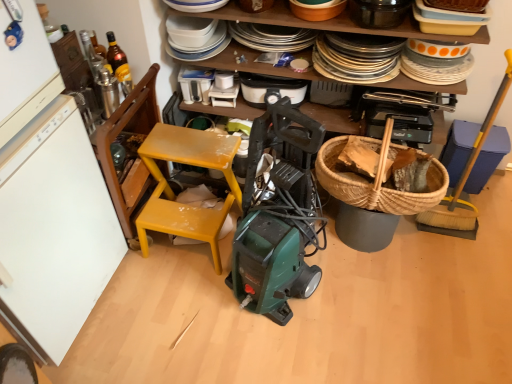
Locate an element on the screen. stainless steel pot at upper center, which is the third appliance in right-to-left order is located at coordinates (379, 13).

What do you see at coordinates (326, 22) in the screenshot?
I see `wooden plate rack at upper center, placed as the second shelf when sorted from front to back` at bounding box center [326, 22].

The height and width of the screenshot is (384, 512). What do you see at coordinates (108, 91) in the screenshot?
I see `metallic silver thermos at upper left, the first appliance positioned from the left` at bounding box center [108, 91].

What do you see at coordinates (195, 84) in the screenshot? The height and width of the screenshot is (384, 512). I see `white plastic container at upper center, the 6th appliance viewed from the right` at bounding box center [195, 84].

In order to face black plastic vacuum cleaner at center, arranged as the 4th appliance when viewed from the right, should I rotate leftwards or rightwards?

A 1.938 degree turn to the right will do.

You are a GUI agent. You are given a task and a screenshot of the screen. Output one action in this format:
    pyautogui.click(x=<x>, y=<y>)
    Task: Click on the yellow plastic broom at right, which is counted as the 2th appliance, starting from the right
    The image size is (512, 384).
    Given the screenshot: What is the action you would take?
    pyautogui.click(x=465, y=179)

I want to click on white matte refrigerator at left, so click(48, 200).

Between stainless steel pot at upper center, which is the third appliance in right-to-left order, and yellow plastic broom at right, which is counted as the 2th appliance, starting from the right, which one has smaller width?

yellow plastic broom at right, which is counted as the 2th appliance, starting from the right, is thinner.

Considering the positions of point (392, 15) and point (474, 222), is point (392, 15) closer or farther from the camera than point (474, 222)?

Clearly, point (392, 15) is closer to the camera than point (474, 222).

From the picture: Measure the distance between stainless steel pot at upper center, the 5th appliance viewed from the left, and yellow plastic broom at right, which is counted as the 2th appliance, starting from the right.

They are 75.41 centimeters apart.

Is stainless steel pot at upper center, which is the third appliance in right-to-left order, aimed at yellow plastic broom at right, which is counted as the 2th appliance, starting from the right?

No.

Identify the location of appliance that is the 4th one below the wooden shelves at upper center, the 2th shelf from the back (from a real-world perspective). The height and width of the screenshot is (384, 512). (270, 90).

Between wooden shelves at upper center, the 2th shelf from the back, and black plastic vacuum cleaner at center, placed as the fourth appliance when sorted from left to right, which one appears on the right side from the viewer's perspective?

Positioned to the right is wooden shelves at upper center, the 2th shelf from the back.

Does wooden shelves at upper center, the 2th shelf from the back, have a greater height compared to black plastic vacuum cleaner at center, arranged as the 4th appliance when viewed from the right?

In fact, wooden shelves at upper center, the 2th shelf from the back, may be shorter than black plastic vacuum cleaner at center, arranged as the 4th appliance when viewed from the right.

Which is correct: yellow matte chair at center is inside translucent glass bottle at upper left, or outside of it?

yellow matte chair at center exists outside the volume of translucent glass bottle at upper left.

From the image's perspective, would you say yellow matte chair at center is positioned over translucent glass bottle at upper left?

Actually, yellow matte chair at center appears below translucent glass bottle at upper left in the image.

Who is shorter, yellow matte chair at center or translucent glass bottle at upper left?

translucent glass bottle at upper left.

Which object is positioned more to the right, black plastic vacuum cleaner at center, placed as the fourth appliance when sorted from left to right, or white plastic toaster at upper center, the fifth appliance from the right?

black plastic vacuum cleaner at center, placed as the fourth appliance when sorted from left to right, is more to the right.

Which is closer, (280, 88) or (214, 83)?

The point (280, 88) is in front.

From a real-world perspective, is black plastic vacuum cleaner at center, placed as the fourth appliance when sorted from left to right, positioned above or below white plastic toaster at upper center, the third appliance when ordered from left to right?

From a real-world perspective, black plastic vacuum cleaner at center, placed as the fourth appliance when sorted from left to right, is physically above white plastic toaster at upper center, the third appliance when ordered from left to right.

Is black plastic vacuum cleaner at center, placed as the fourth appliance when sorted from left to right, not close to white plastic toaster at upper center, the third appliance when ordered from left to right?

No, there isn't a large distance between black plastic vacuum cleaner at center, placed as the fourth appliance when sorted from left to right, and white plastic toaster at upper center, the third appliance when ordered from left to right.

Who is bigger, metallic silver thermos at upper left, the seventh appliance in the right-to-left sequence, or yellow plastic broom at right, which is counted as the 2th appliance, starting from the right?

yellow plastic broom at right, which is counted as the 2th appliance, starting from the right, is bigger.

The height and width of the screenshot is (384, 512). Find the location of `appliance that is the 5th one when counting leftward from the yellow plastic broom at right, which is the sixth appliance from left to right`. appliance that is the 5th one when counting leftward from the yellow plastic broom at right, which is the sixth appliance from left to right is located at coordinates (108, 91).

Considering the relative positions of metallic silver thermos at upper left, the seventh appliance in the right-to-left sequence, and yellow plastic broom at right, which is counted as the 2th appliance, starting from the right, in the image provided, is metallic silver thermos at upper left, the seventh appliance in the right-to-left sequence, to the right of yellow plastic broom at right, which is counted as the 2th appliance, starting from the right, from the viewer's perspective?

No, metallic silver thermos at upper left, the seventh appliance in the right-to-left sequence, is not to the right of yellow plastic broom at right, which is counted as the 2th appliance, starting from the right.

From the image's perspective, is metallic silver thermos at upper left, the seventh appliance in the right-to-left sequence, located beneath yellow plastic broom at right, which is counted as the 2th appliance, starting from the right?

Actually, metallic silver thermos at upper left, the seventh appliance in the right-to-left sequence, appears above yellow plastic broom at right, which is counted as the 2th appliance, starting from the right, in the image.

Does point (226, 89) appear closer or farther from the camera than point (188, 69)?

Point (226, 89) appears to be closer to the viewer than point (188, 69).

Is white plastic toaster at upper center, the fifth appliance from the right, oriented away from white plastic container at upper center, which appears as the second appliance when viewed from the left?

No, white plastic container at upper center, which appears as the second appliance when viewed from the left, is not at the back of white plastic toaster at upper center, the fifth appliance from the right.

Considering the relative positions of white plastic toaster at upper center, the third appliance when ordered from left to right, and white plastic container at upper center, the 6th appliance viewed from the right, in the image provided, is white plastic toaster at upper center, the third appliance when ordered from left to right, in front of white plastic container at upper center, the 6th appliance viewed from the right,?

Yes, white plastic toaster at upper center, the third appliance when ordered from left to right, is closer to the camera.

Find the location of `appliance that is the 1st one when counting backward from the white plastic toaster at upper center, the third appliance when ordered from left to right`. appliance that is the 1st one when counting backward from the white plastic toaster at upper center, the third appliance when ordered from left to right is located at coordinates (195, 84).

Considering the relative sizes of white plastic container at upper center, the 6th appliance viewed from the right, and black plastic vacuum cleaner at center, arranged as the 4th appliance when viewed from the right, in the image provided, is white plastic container at upper center, the 6th appliance viewed from the right, shorter than black plastic vacuum cleaner at center, arranged as the 4th appliance when viewed from the right,?

Yes, white plastic container at upper center, the 6th appliance viewed from the right, is shorter than black plastic vacuum cleaner at center, arranged as the 4th appliance when viewed from the right.

Which appliance is the 2nd one when counting from the front of the white plastic container at upper center, the 6th appliance viewed from the right? Please provide its 2D coordinates.

[(270, 90)]

Is point (182, 88) closer or farther from the camera than point (243, 93)?

Point (182, 88) appears to be farther away from the viewer than point (243, 93).

From the image's perspective, does white plastic container at upper center, which appears as the second appliance when viewed from the left, appear lower than black plastic vacuum cleaner at center, arranged as the 4th appliance when viewed from the right?

No, from the image's perspective, white plastic container at upper center, which appears as the second appliance when viewed from the left, is not beneath black plastic vacuum cleaner at center, arranged as the 4th appliance when viewed from the right.

Find the location of `the 2nd appliance in front of the yellow plastic broom at right, which is counted as the 2th appliance, starting from the right, counting from the anchor's position`. the 2nd appliance in front of the yellow plastic broom at right, which is counted as the 2th appliance, starting from the right, counting from the anchor's position is located at coordinates (379, 13).

This screenshot has width=512, height=384. I want to click on the 1st appliance to the left of the wooden shelves at upper center, which is the 1th shelf in front-to-back order, starting your count from the anchor, so click(270, 90).

Which object lies nearer to the anchor point stainless steel pot at upper center, the 5th appliance viewed from the left, metallic silver thermos at upper left, the seventh appliance in the right-to-left sequence, or wooden plate rack at upper center, the first shelf viewed from the back?

wooden plate rack at upper center, the first shelf viewed from the back.

Considering their positions, is stainless steel pot at upper center, which is the third appliance in right-to-left order, positioned closer to wooden plate rack at upper center, placed as the second shelf when sorted from front to back, than woven brown picnic basket at right?

The object closer to wooden plate rack at upper center, placed as the second shelf when sorted from front to back, is stainless steel pot at upper center, which is the third appliance in right-to-left order.

From the image, which object appears to be nearer to stainless steel pot at upper center, the 5th appliance viewed from the left, wooden shelves at upper center, which is the 1th shelf in front-to-back order, or blue plastic trash can at right, which is counted as the first appliance, starting from the right?

The object closer to stainless steel pot at upper center, the 5th appliance viewed from the left, is wooden shelves at upper center, which is the 1th shelf in front-to-back order.

When comparing their distances from white plastic container at upper center, which appears as the second appliance when viewed from the left, does blue plastic trash can at right, which is counted as the first appliance, starting from the right, or metallic silver thermos at upper left, the first appliance positioned from the left, seem closer?

The object closer to white plastic container at upper center, which appears as the second appliance when viewed from the left, is metallic silver thermos at upper left, the first appliance positioned from the left.

When comparing their distances from yellow plastic broom at right, which is counted as the 2th appliance, starting from the right, does wooden plate rack at upper center, placed as the second shelf when sorted from front to back, or stainless steel pot at upper center, which is the third appliance in right-to-left order, seem further?

The object further to yellow plastic broom at right, which is counted as the 2th appliance, starting from the right, is stainless steel pot at upper center, which is the third appliance in right-to-left order.

Looking at this image, when comparing their distances from stainless steel pot at upper center, which is the third appliance in right-to-left order, does yellow plastic broom at right, which is the sixth appliance from left to right, or metallic silver thermos at upper left, the first appliance positioned from the left, seem closer?

yellow plastic broom at right, which is the sixth appliance from left to right, is closer to stainless steel pot at upper center, which is the third appliance in right-to-left order.

Based on their spatial positions, is woven brown picnic basket at right or white plastic container at upper center, the 6th appliance viewed from the right, further from stainless steel pot at upper center, which is the third appliance in right-to-left order?

white plastic container at upper center, the 6th appliance viewed from the right, is positioned further to the anchor stainless steel pot at upper center, which is the third appliance in right-to-left order.

Looking at the image, which one is located closer to translucent glass bottle at upper left, blue plastic trash can at right, the seventh appliance from the left, or white matte refrigerator at left?

The object closer to translucent glass bottle at upper left is white matte refrigerator at left.

This screenshot has width=512, height=384. Identify the location of appliance between white plastic container at upper center, the 6th appliance viewed from the right, and black plastic vacuum cleaner at center, placed as the fourth appliance when sorted from left to right. (224, 89).

The width and height of the screenshot is (512, 384). What are the coordinates of `picnic basket between white plastic toaster at upper center, the fifth appliance from the right, and blue plastic trash can at right, which is counted as the first appliance, starting from the right, in the horizontal direction` in the screenshot? It's located at (373, 183).

Find the location of a particular element. This screenshot has width=512, height=384. shelf between stainless steel pot at upper center, which is the third appliance in right-to-left order, and woven brown picnic basket at right vertically is located at coordinates (326, 22).

The width and height of the screenshot is (512, 384). I want to click on chair between metallic silver thermos at upper left, the first appliance positioned from the left, and yellow plastic broom at right, which is counted as the 2th appliance, starting from the right, in the horizontal direction, so click(173, 192).